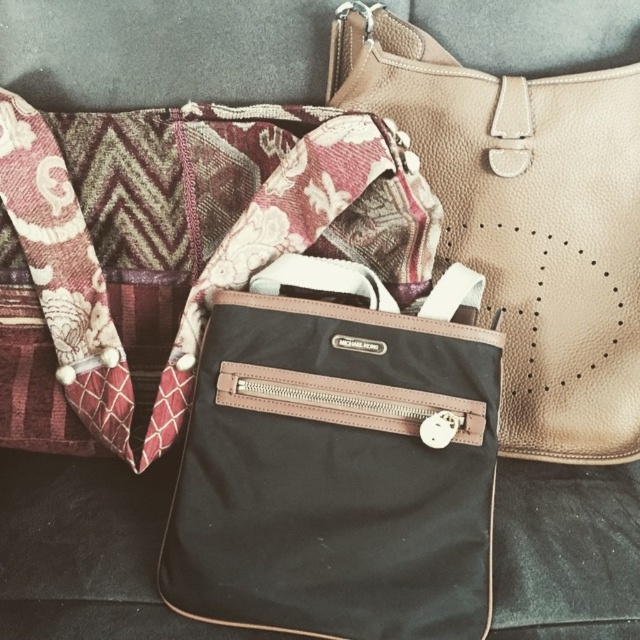
Question: Which point is farther to the camera?

Choices:
 (A) (362, 320)
 (B) (168, 378)

Answer: (B)

Question: Among these objects, which one is nearest to the camera?

Choices:
 (A) matte black nylon bag at center
 (B) black nylon bag at center

Answer: (B)

Question: Estimate the real-world distances between objects in this image. Which object is closer to the matte beige leather shoulder bag at upper right?

Choices:
 (A) matte black nylon bag at center
 (B) black nylon bag at center

Answer: (B)

Question: Is black nylon bag at center wider than matte black nylon bag at center?

Choices:
 (A) no
 (B) yes

Answer: (A)

Question: Is matte black nylon bag at center further to the viewer compared to matte beige leather shoulder bag at upper right?

Choices:
 (A) yes
 (B) no

Answer: (B)

Question: Where is black nylon bag at center located in relation to matte beige leather shoulder bag at upper right in the image?

Choices:
 (A) right
 (B) left

Answer: (B)